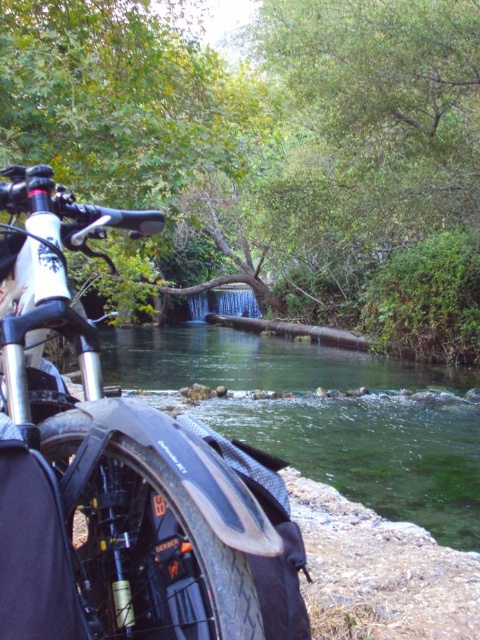
Question: Does shiny metallic bicycle at left have a lesser width compared to clear water at center?

Choices:
 (A) yes
 (B) no

Answer: (A)

Question: Does shiny metallic bicycle at left appear on the right side of clear water at center?

Choices:
 (A) no
 (B) yes

Answer: (A)

Question: Does shiny metallic bicycle at left lie in front of clear water at center?

Choices:
 (A) no
 (B) yes

Answer: (B)

Question: Among these points, which one is nearest to the camera?

Choices:
 (A) [476, 385]
 (B) [79, 593]

Answer: (B)